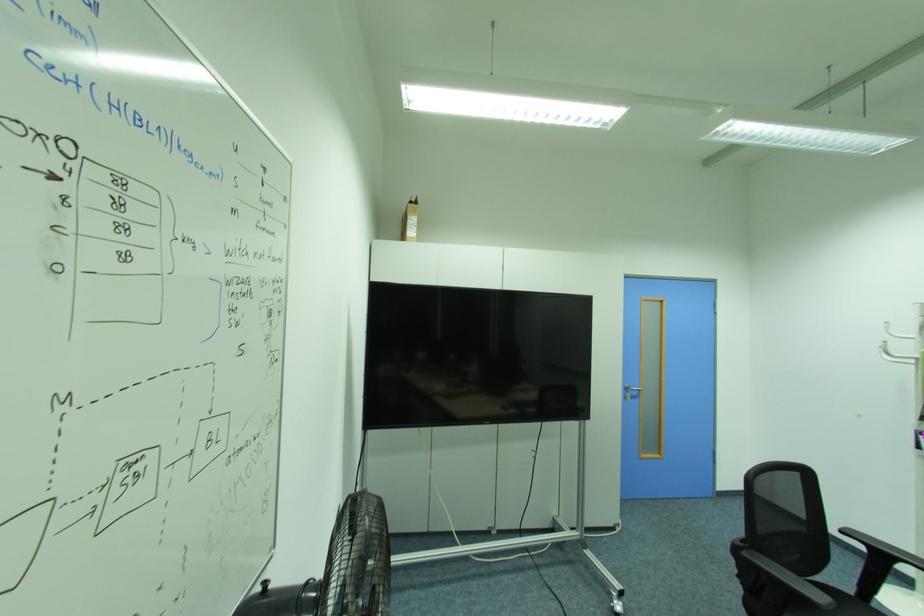
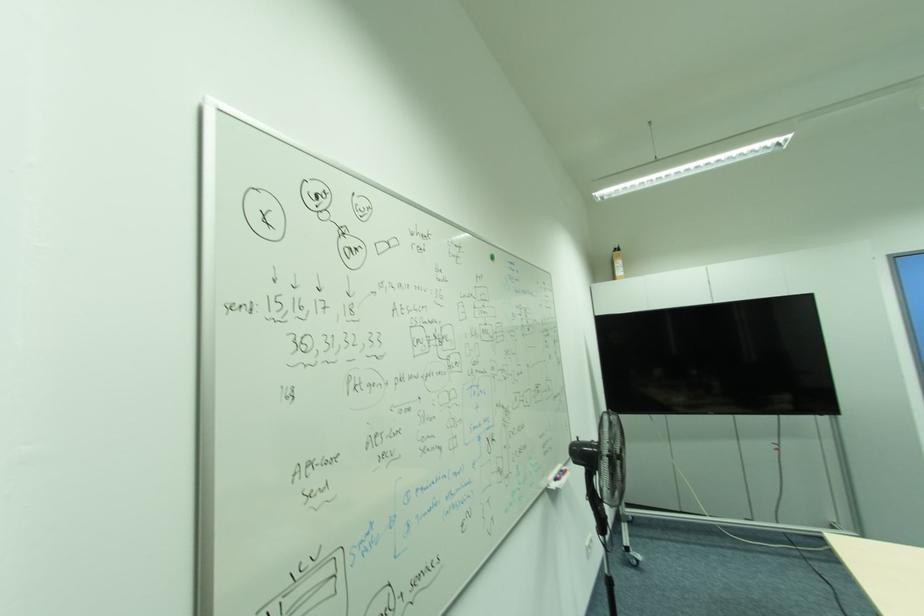
In the second image, find the point that corresponds to point (412, 225) in the first image.

(621, 269)